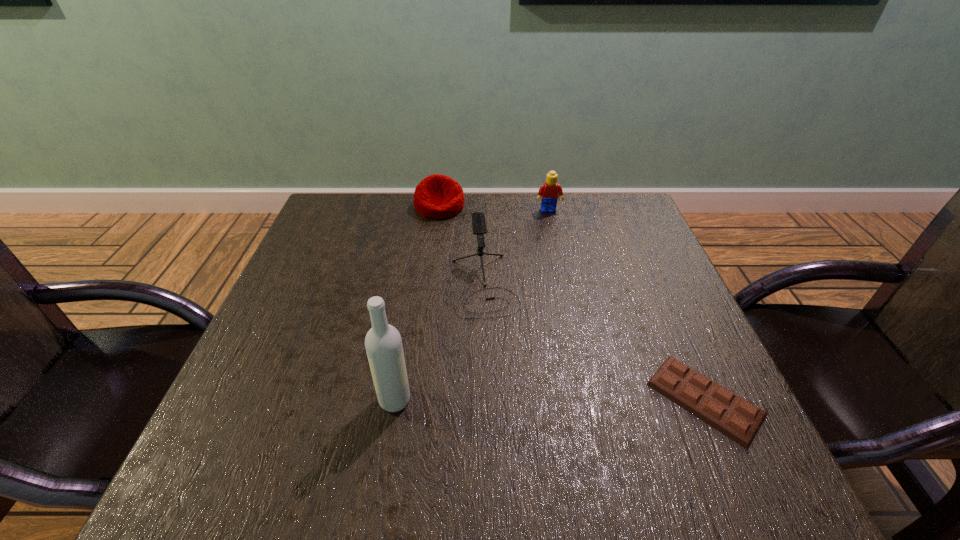
What are the coordinates of `free space on the desktop that is between the tallest object and the chocolate bar and is positioned on the stand of the third farthest object` in the screenshot? It's located at (514, 400).

Identify the location of free spot on the desktop that is between the tallest object and the shortest object and is positioned on the seat area of the fourth tallest object. This screenshot has width=960, height=540. (532, 400).

I want to click on free space on the desktop that is between the vodka and the rightmost object and is positioned on the front-facing side of the Lego, so click(590, 399).